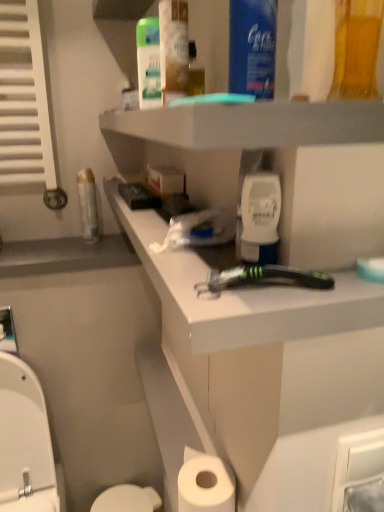
Question: From a real-world perspective, relative to blue plastic mouthwash at upper center, placed as the 4th mouthwash when sorted from back to front, is white glossy toilet bowl at lower left vertically above or below?

Choices:
 (A) above
 (B) below

Answer: (B)

Question: Is white glossy toilet bowl at lower left bigger or smaller than blue plastic mouthwash at upper center, which is counted as the third mouthwash, starting from the right?

Choices:
 (A) small
 (B) big

Answer: (B)

Question: Considering the real-world distances, which object is farthest from the translucent yellow liquid at upper right, the 5th mouthwash positioned from the left?

Choices:
 (A) white plastic toilet seat at lower left
 (B) translucent plastic mouthwash at upper center, the 2th mouthwash viewed from the back
 (C) white matte toilet paper at lower center
 (D) white plastic razor at center
 (E) white matte mouthwash at center, which is the third mouthwash in back-to-front order

Answer: (A)

Question: Estimate the real-world distances between objects in this image. Which object is farther from the black plastic razor at center?

Choices:
 (A) blue plastic mouthwash at upper center, which is counted as the third mouthwash, starting from the right
 (B) translucent yellow liquid at upper right, which appears as the 1th mouthwash when viewed from the right
 (C) white plastic razor at center
 (D) white matte mouthwash at center, which is the third mouthwash in back-to-front order
 (E) white glossy toilet bowl at lower left

Answer: (E)